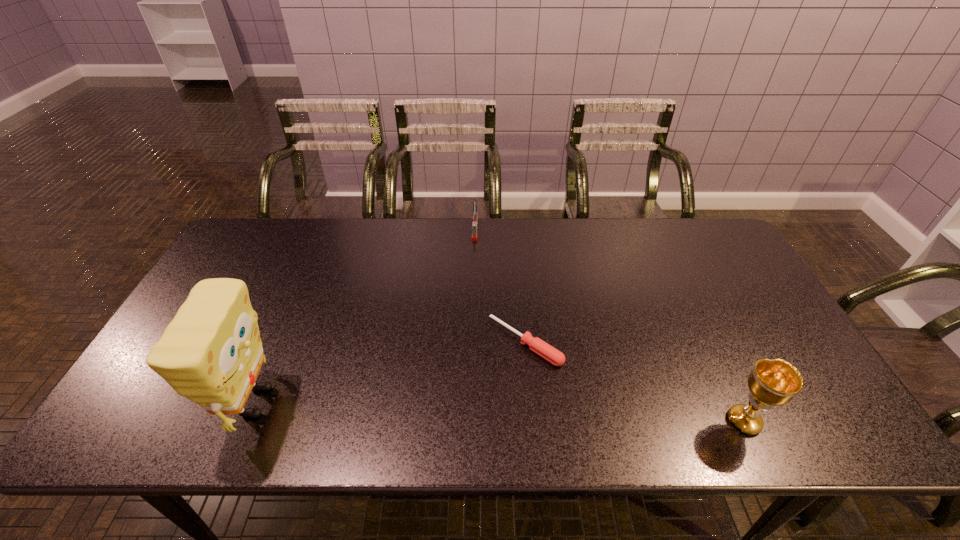
Find the location of a particular element. vacant point located between the tallest object and the stapler is located at coordinates pyautogui.click(x=365, y=316).

Image resolution: width=960 pixels, height=540 pixels. Find the location of `vacant area that lies between the stapler and the sponge`. vacant area that lies between the stapler and the sponge is located at coordinates (365, 316).

Locate an element on the screen. The image size is (960, 540). object that is the second closest one to the screwdriver is located at coordinates (775, 382).

Identify which object is the second nearest to the second tallest object. Please provide its 2D coordinates. Your answer should be formatted as a tuple, i.e. [(x, y)], where the tuple contains the x and y coordinates of a point satisfying the conditions above.

[(475, 214)]

Find the location of a particular element. The width and height of the screenshot is (960, 540). vacant area that satisfies the following two spatial constraints: 1. on the front side of the farthest object; 2. on the left side of the shortest object is located at coordinates (473, 342).